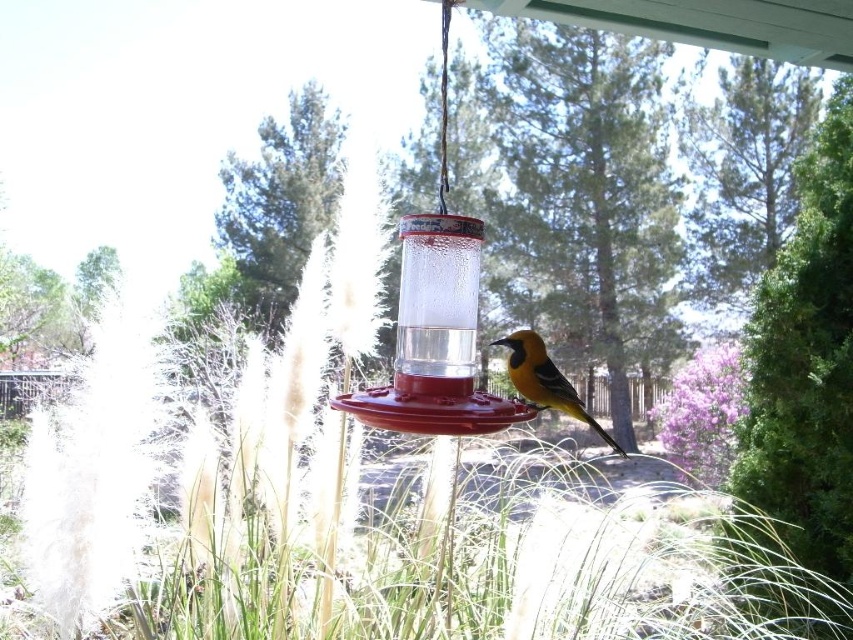
You are a bird trying to reach the transparent plastic bird feeder at center. The feeder is located at coordinates 0.530, 0.511. If you start from the tall feathery grasses in the foreground, which direction should you fly to reach the feeder?

The transparent plastic bird feeder at center is located at point (434, 339). Since the feeder is at the center of the image and the grasses are in the foreground, you should fly towards the center to reach it.